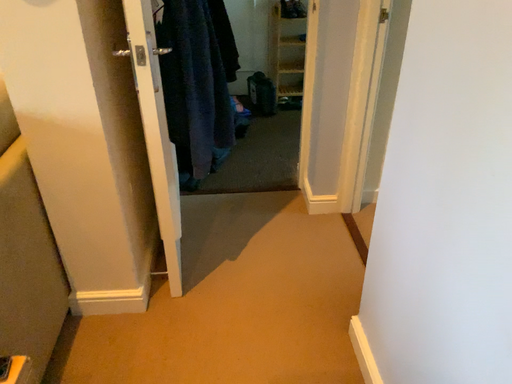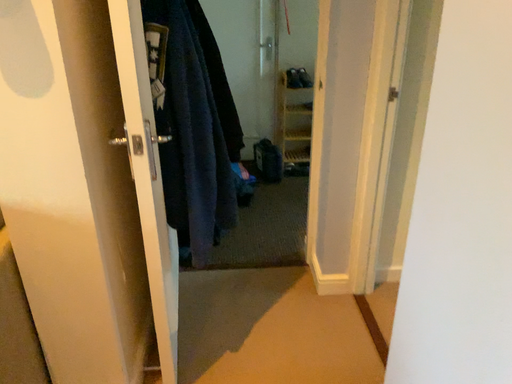
Question: Which way did the camera rotate in the video?

Choices:
 (A) rotated upward
 (B) rotated downward

Answer: (A)